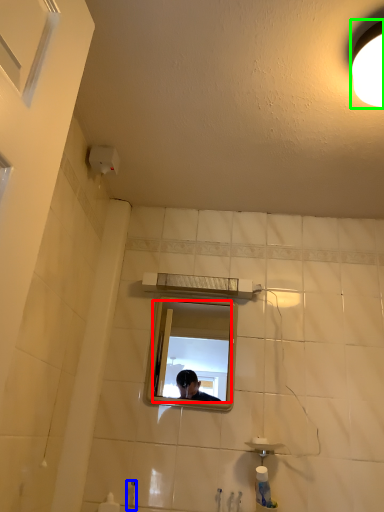
Question: Which is farther away from mirror (highlighted by a red box)? faucet (highlighted by a blue box) or light fixture (highlighted by a green box)?

Choices:
 (A) faucet
 (B) light fixture

Answer: (B)